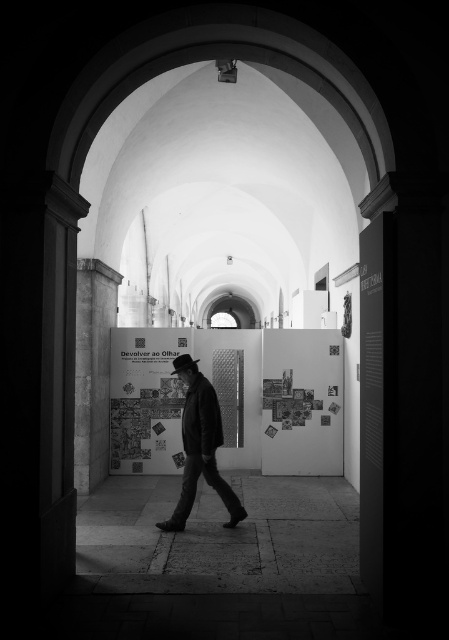
Does smooth stone pavement at center come in front of dark textured coat at center?

Yes, smooth stone pavement at center is closer to the viewer.

Is point (95, 531) positioned after point (181, 499)?

Yes.

Between point (180, 586) and point (184, 465), which one is positioned in front?

Point (180, 586)

The width and height of the screenshot is (449, 640). In order to click on smooth stone pavement at center in this screenshot , I will do `click(223, 536)`.

Is printed paper poster at center positioned in front of black felt fedora at center?

No, it is behind black felt fedora at center.

Where is `printed paper poster at center`? This screenshot has height=640, width=449. printed paper poster at center is located at coordinates (145, 400).

Find the location of `printed paper poster at center`. printed paper poster at center is located at coordinates (145, 400).

Can you confirm if smooth stone pavement at center is thinner than printed paper poster at center?

No.

Which of these two, smooth stone pavement at center or printed paper poster at center, stands taller?

printed paper poster at center

Does point (184, 541) lie in front of point (127, 364)?

Yes.

The width and height of the screenshot is (449, 640). Find the location of `smooth stone pavement at center`. smooth stone pavement at center is located at coordinates (223, 536).